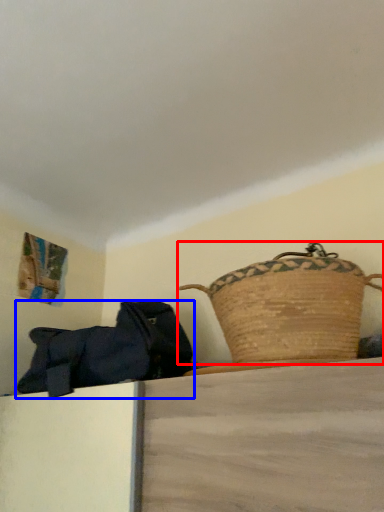
Question: Which object is closer to the camera taking this photo, picnic basket (highlighted by a red box) or handbag (highlighted by a blue box)?

Choices:
 (A) picnic basket
 (B) handbag

Answer: (A)